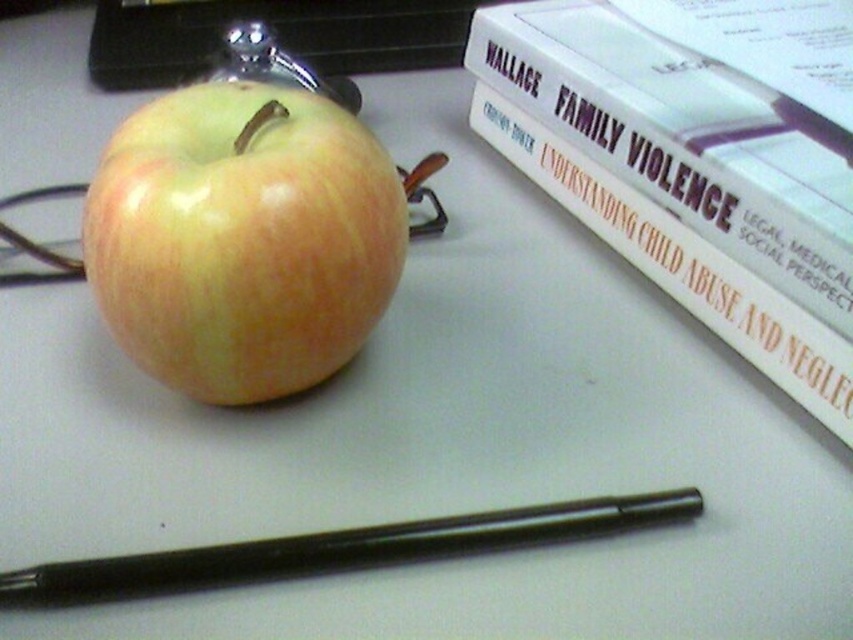
You are organizing items on a desk and need to place a new item between the hardcover book at upper right and the yellow matte apple at center. Considering their sizes, which object should you place closer to the smaller one to maintain balance?

The yellow matte apple at center is smaller than the hardcover book at upper right. To maintain balance, place the new item closer to the yellow matte apple at center so that the distances from each object to the item are proportional to their sizes.

You are organizing items on a desk. You have a hardcover book at upper right and a black matte pen at lower center. Which item is taller?

The hardcover book at upper right is taller than the black matte pen at lower center.